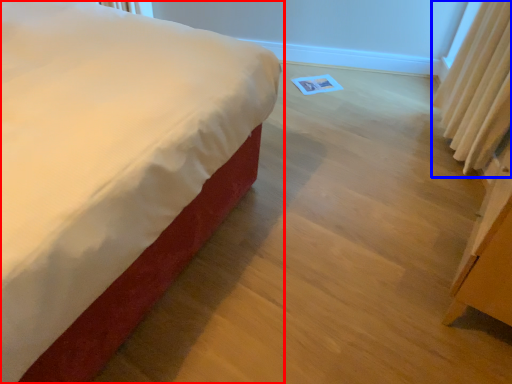
Question: Which of the following is the farthest to the observer, bed (highlighted by a red box) or curtain (highlighted by a blue box)?

Choices:
 (A) bed
 (B) curtain

Answer: (B)